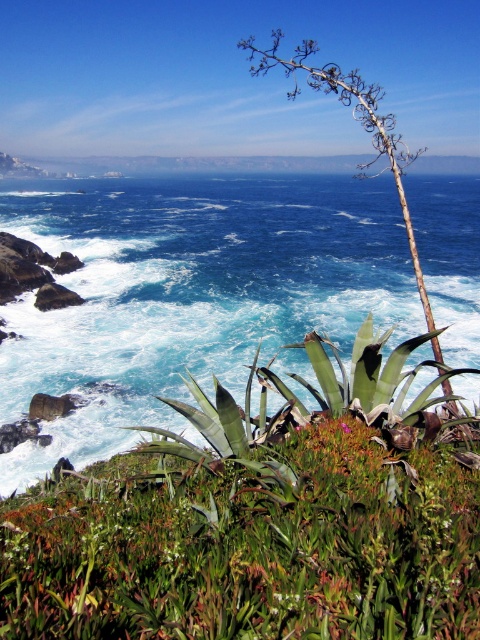
Between point (425, 451) and point (228, 349), which one is positioned in front?

Point (425, 451) is more forward.

The image size is (480, 640). What are the coordinates of `green leafy plant at center` in the screenshot? It's located at (259, 522).

Locate an element on the screen. green leafy plant at center is located at coordinates (259, 522).